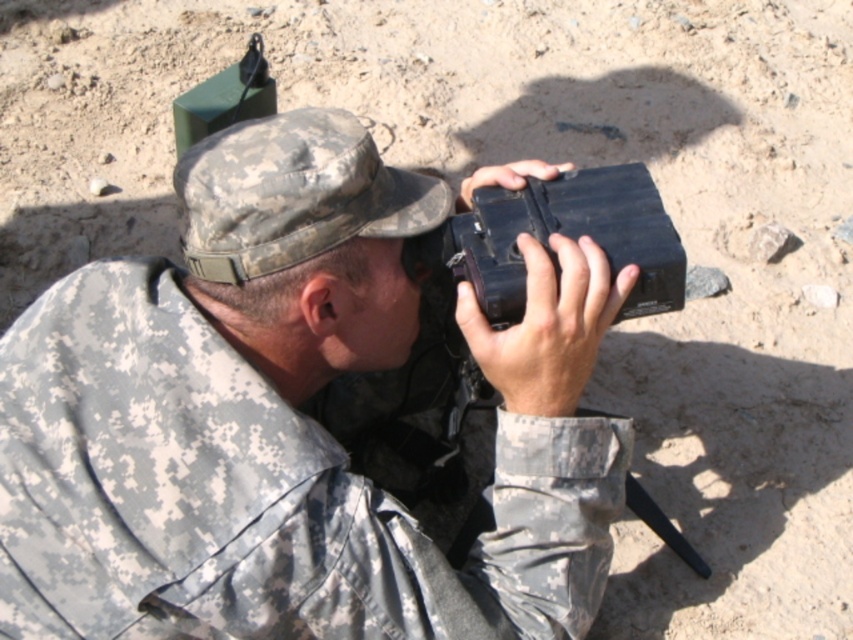
Based on the photo, you are a drone operator trying to locate two points in an image. The first point is at coordinates point (196, 234) and the second is at point (523, 260). Which point is nearer to the camera?

Point (196, 234) is closer to the camera than point (523, 260).

You are a field technician trying to pack up your equipment. You have a matte black case at upper center and a black matte camera at center. Which item should you place first into your storage container if you want to maximize space efficiency?

You should place the matte black case at upper center first because it is larger than the black matte camera at center, allowing smaller items to be placed around it for better space efficiency.

You are a photographer trying to set up your equipment. You have a matte black case at upper center and a black matte camera at center. Which object is positioned higher in the image?

The black matte camera at center is higher because the matte black case at upper center is below it.